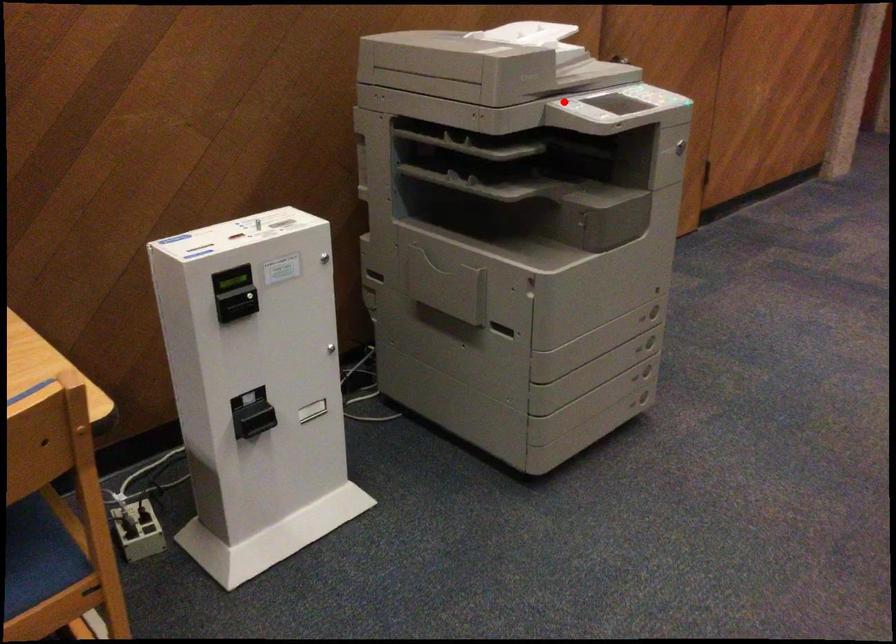
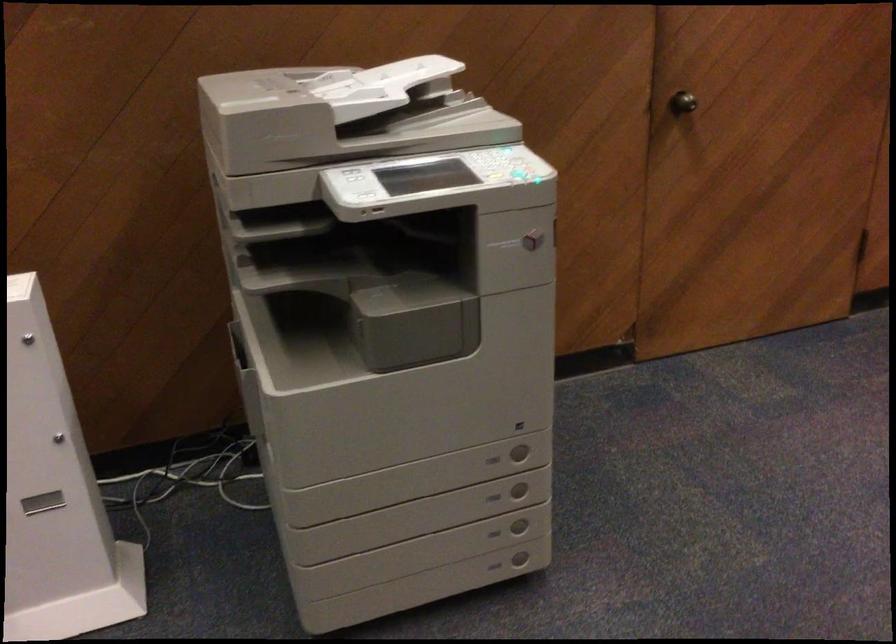
Find the pixel in the second image that matches the highlighted location in the first image.

(354, 175)